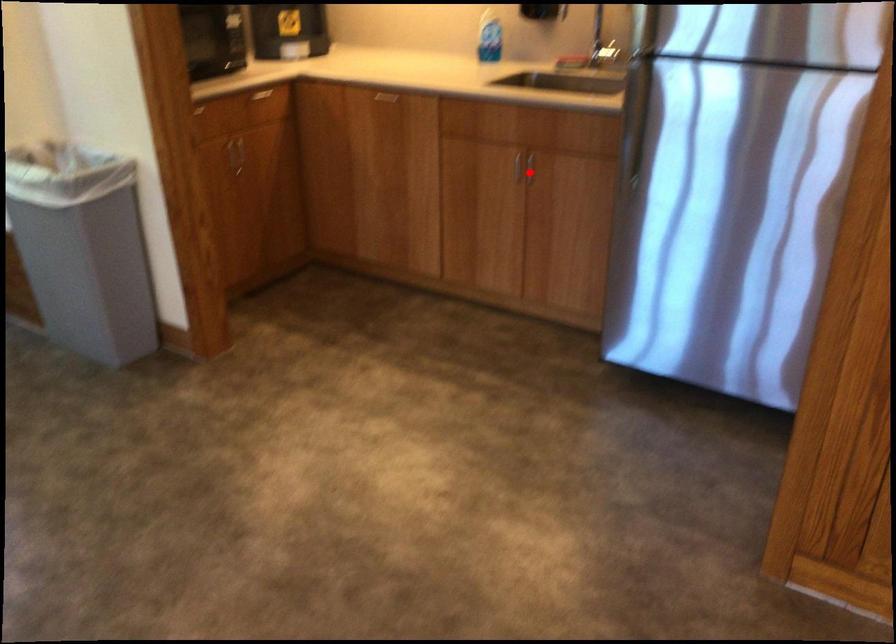
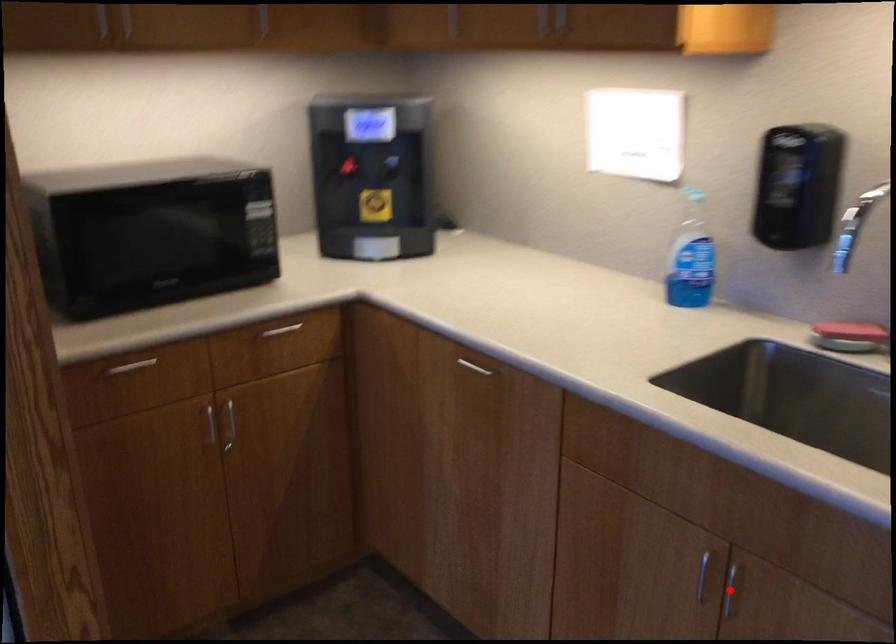
I am providing you with two images of the same scene from different viewpoints. A red point is marked on the first image and another point is marked on the second image. Do the highlighted points in image1 and image2 indicate the same real-world spot?

Yes